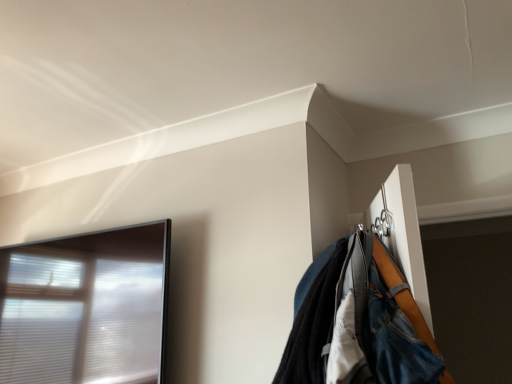
Question: Is transparent glass window at left wider than denim jacket at upper right?

Choices:
 (A) yes
 (B) no

Answer: (B)

Question: Would you say transparent glass window at left contains denim jacket at upper right?

Choices:
 (A) yes
 (B) no

Answer: (B)

Question: Is transparent glass window at left smaller than denim jacket at upper right?

Choices:
 (A) yes
 (B) no

Answer: (B)

Question: Considering the relative sizes of transparent glass window at left and denim jacket at upper right in the image provided, is transparent glass window at left taller than denim jacket at upper right?

Choices:
 (A) no
 (B) yes

Answer: (B)

Question: Considering the relative positions of transparent glass window at left and denim jacket at upper right in the image provided, is transparent glass window at left to the right of denim jacket at upper right from the viewer's perspective?

Choices:
 (A) no
 (B) yes

Answer: (A)

Question: Considering the relative sizes of transparent glass window at left and denim jacket at upper right in the image provided, is transparent glass window at left bigger than denim jacket at upper right?

Choices:
 (A) yes
 (B) no

Answer: (A)

Question: From a real-world perspective, is denim jacket at upper right physically below transparent glass window at left?

Choices:
 (A) yes
 (B) no

Answer: (A)

Question: Is denim jacket at upper right in contact with transparent glass window at left?

Choices:
 (A) yes
 (B) no

Answer: (B)

Question: Is denim jacket at upper right positioned in front of transparent glass window at left?

Choices:
 (A) no
 (B) yes

Answer: (B)

Question: Considering the relative sizes of denim jacket at upper right and transparent glass window at left in the image provided, is denim jacket at upper right wider than transparent glass window at left?

Choices:
 (A) yes
 (B) no

Answer: (A)

Question: From the image's perspective, is denim jacket at upper right above transparent glass window at left?

Choices:
 (A) no
 (B) yes

Answer: (B)

Question: Considering the relative sizes of denim jacket at upper right and transparent glass window at left in the image provided, is denim jacket at upper right shorter than transparent glass window at left?

Choices:
 (A) no
 (B) yes

Answer: (B)

Question: From the image's perspective, relative to transparent glass window at left, is denim jacket at upper right above or below?

Choices:
 (A) above
 (B) below

Answer: (A)